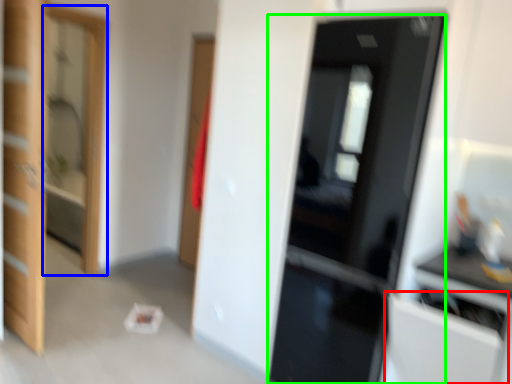
Question: Which object is positioned farthest from cabinetry (highlighted by a red box)? Select from screen door (highlighted by a blue box) and door (highlighted by a green box).

Choices:
 (A) screen door
 (B) door

Answer: (A)